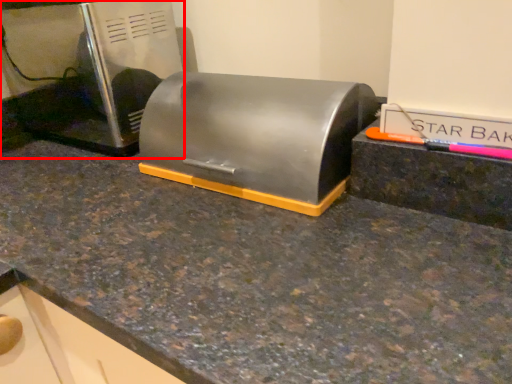
Question: Where is home appliance (annotated by the red box) located in relation to appliance in the image?

Choices:
 (A) right
 (B) left

Answer: (B)